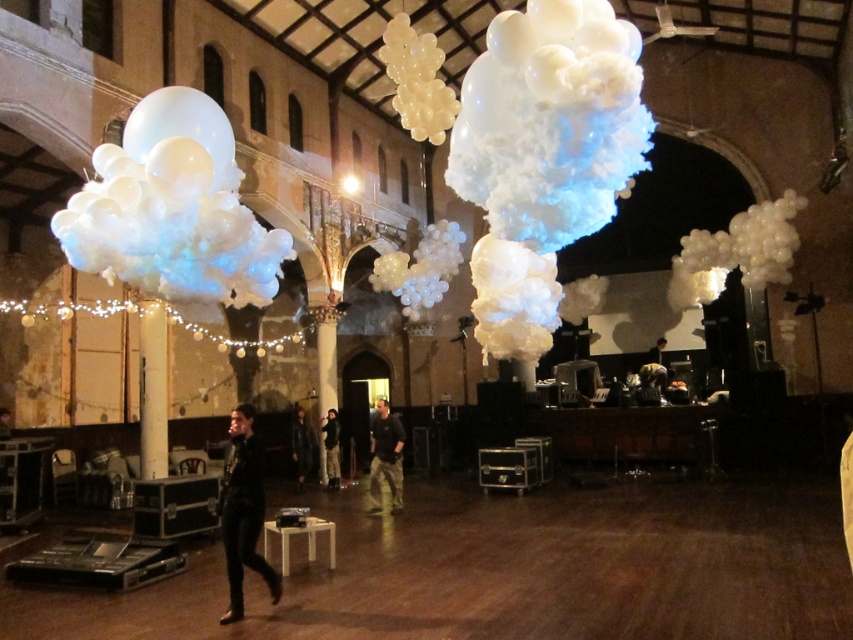
You are standing in the middle of the large hall and want to move towards the black matte clothing at center. In which direction should you move relative to your current position?

Since the black matte clothing at center is located at point (x=242, y=513), you should move towards the lower right direction from your current position in the middle of the hall.

You are a delivery person carrying a large box that measures 2 meters in length. You need to navigate through the space between the black matte clothing at center and the dark brown leather jacket at center. Can you safely pass through this space without damaging the balloons or the box?

The distance between the black matte clothing at center and the dark brown leather jacket at center is 4.21 meters. Since your box is 2 meters long, there is sufficient space to pass through safely as the distance is more than double the box length.